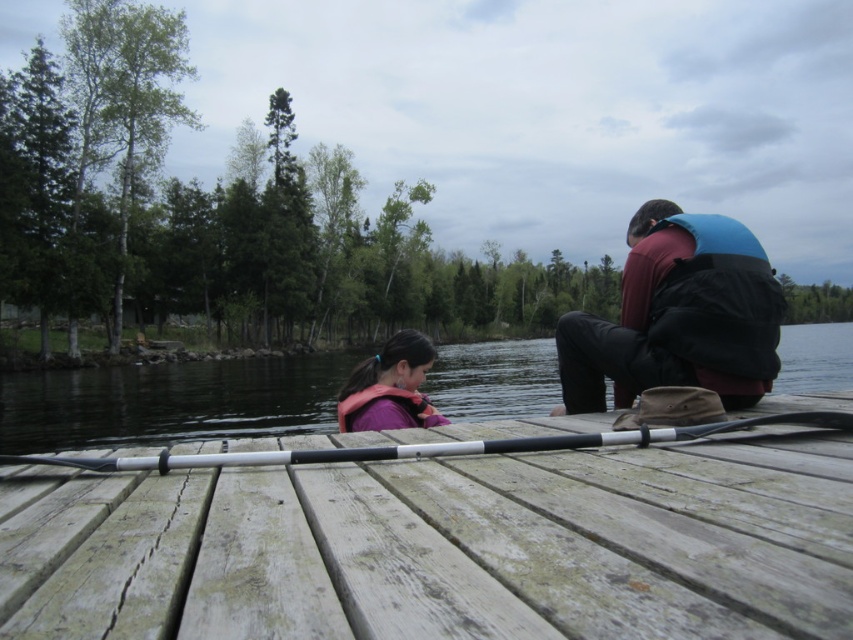
Question: Which is nearer to the black rubber paddle at center?

Choices:
 (A) weathered wood dock at center
 (B) blue matte life vest at right
 (C) purple life vest at center

Answer: (A)

Question: Estimate the real-world distances between objects in this image. Which object is closer to the weathered wood dock at center?

Choices:
 (A) transparent water at dock center
 (B) purple life vest at center
 (C) black rubber paddle at center
 (D) blue matte life vest at right

Answer: (C)

Question: Where is weathered wood dock at center located in relation to transparent water at dock center in the image?

Choices:
 (A) above
 (B) below

Answer: (B)

Question: Can you confirm if blue matte life vest at right is wider than purple life vest at center?

Choices:
 (A) yes
 (B) no

Answer: (B)

Question: Can you confirm if black rubber paddle at center is positioned above purple life vest at center?

Choices:
 (A) no
 (B) yes

Answer: (A)

Question: Considering the real-world distances, which object is closest to the black rubber paddle at center?

Choices:
 (A) purple life vest at center
 (B) weathered wood dock at center

Answer: (B)